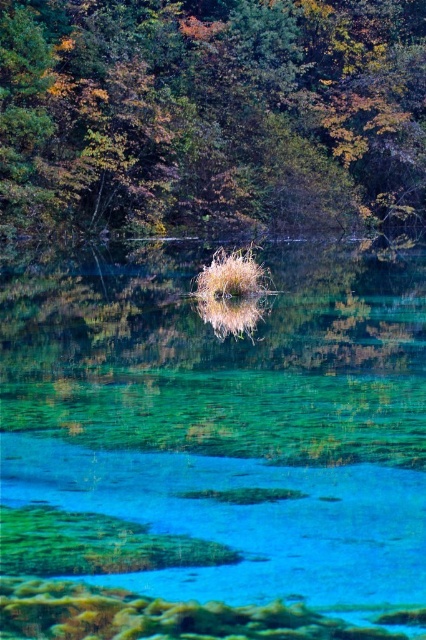
Who is more forward, (388, 589) or (77, 184)?

Positioned in front is point (388, 589).

Who is more distant from viewer, (293, 604) or (391, 99)?

The point (391, 99) is behind.

Locate an element on the screen. The height and width of the screenshot is (640, 426). clear glass water at center is located at coordinates (213, 451).

Is point (20, 564) farther from camera compared to point (262, 273)?

No.

Where is `clear glass water at center`? clear glass water at center is located at coordinates (213, 451).

Does green leafy tree at upper center appear on the left side of dry grass at center?

No, green leafy tree at upper center is not to the left of dry grass at center.

The height and width of the screenshot is (640, 426). What do you see at coordinates (210, 115) in the screenshot?
I see `green leafy tree at upper center` at bounding box center [210, 115].

Locate an element on the screen. This screenshot has height=640, width=426. green leafy tree at upper center is located at coordinates (210, 115).